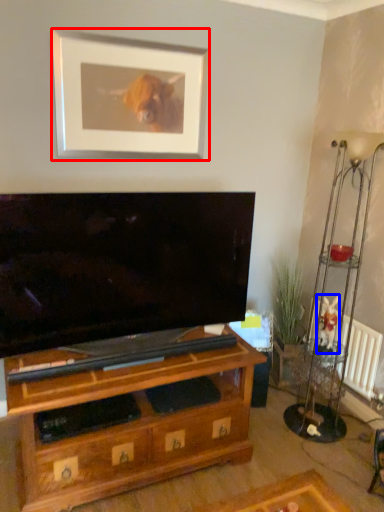
Question: Which object appears closest to the camera in this image, picture frame (highlighted by a red box) or animal (highlighted by a blue box)?

Choices:
 (A) picture frame
 (B) animal

Answer: (A)